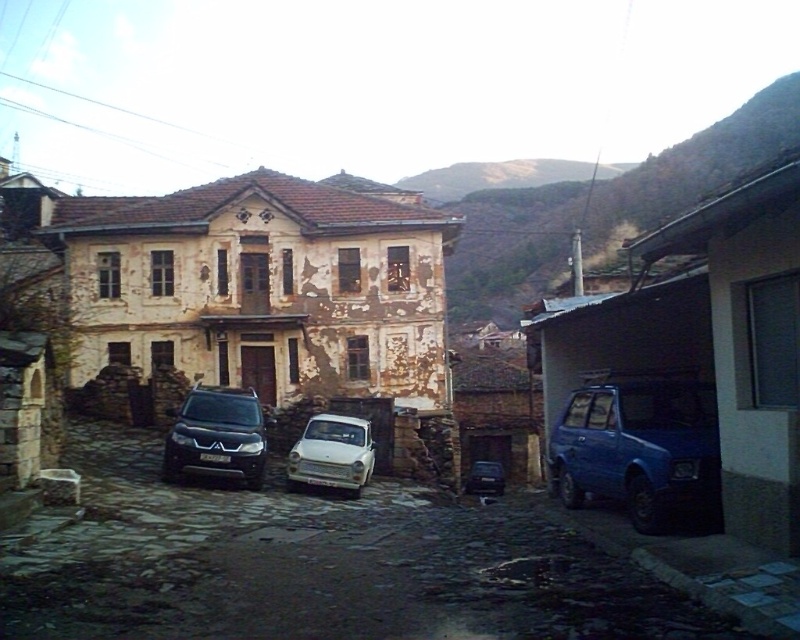
Between satin black suv at center and metallic blue sedan at center, which one is positioned lower?

metallic blue sedan at center is lower down.

Does satin black suv at center have a smaller size compared to metallic blue sedan at center?

No.

Who is more forward, (186,461) or (480,484)?

Positioned in front is point (186,461).

Identify the location of satin black suv at center. 216,435.

Who is more distant from viewer, (326, 468) or (492, 486)?

The point (492, 486) is behind.

Is white matte car at center closer to camera compared to metallic blue sedan at center?

Yes, it is in front of metallic blue sedan at center.

Which is in front, point (310, 433) or point (482, 465)?

Point (310, 433) is more forward.

Locate an element on the screen. This screenshot has height=640, width=800. white matte car at center is located at coordinates (332, 454).

Can you confirm if blue matte car at right is smaller than metallic blue sedan at center?

Actually, blue matte car at right might be larger than metallic blue sedan at center.

Between blue matte car at right and metallic blue sedan at center, which one has more height?

Standing taller between the two is blue matte car at right.

I want to click on blue matte car at right, so click(x=640, y=451).